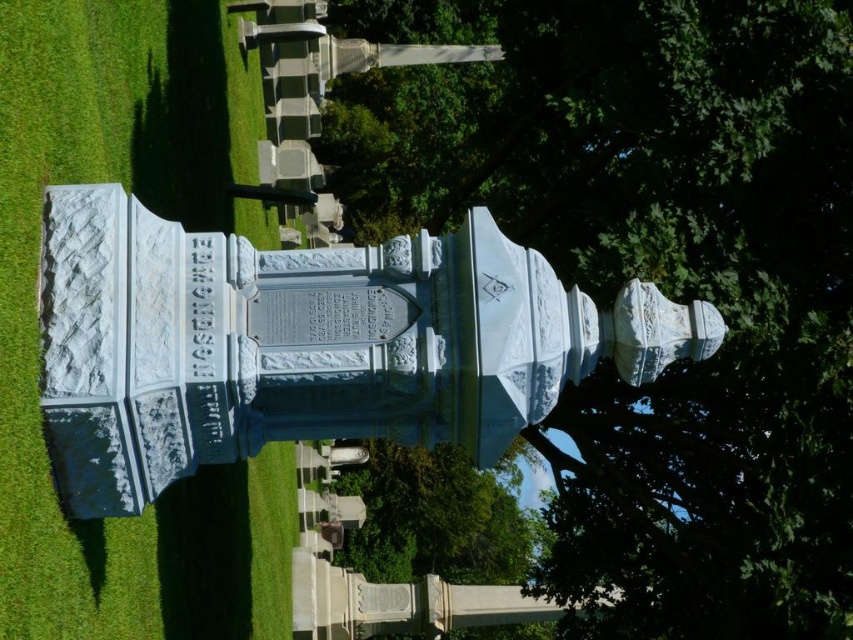
The image size is (853, 640). What do you see at coordinates (306, 342) in the screenshot? I see `white marble monument at center` at bounding box center [306, 342].

Is white marble monument at center closer to camera compared to green grass at lower left?

That is False.

Who is more forward, (x=53, y=374) or (x=93, y=625)?

Point (x=53, y=374) is more forward.

Locate an element on the screen. white marble monument at center is located at coordinates (306, 342).

I want to click on white marble monument at center, so click(x=306, y=342).

Who is higher up, white marble monument at center or green leafy tree at center?

white marble monument at center is above.

Does point (248, 349) lie behind point (405, 538)?

No, it is not.

Find the location of a particular element. white marble monument at center is located at coordinates (306, 342).

Is green leafy tree at upper center in front of green leafy tree at center?

Yes, green leafy tree at upper center is closer to the viewer.

Between green leafy tree at upper center and green leafy tree at center, which one has more height?

With more height is green leafy tree at upper center.

Between point (583, 282) and point (427, 572), which one is positioned in front?

Point (583, 282)

Image resolution: width=853 pixels, height=640 pixels. In order to click on green leafy tree at upper center in this screenshot , I will do `click(654, 275)`.